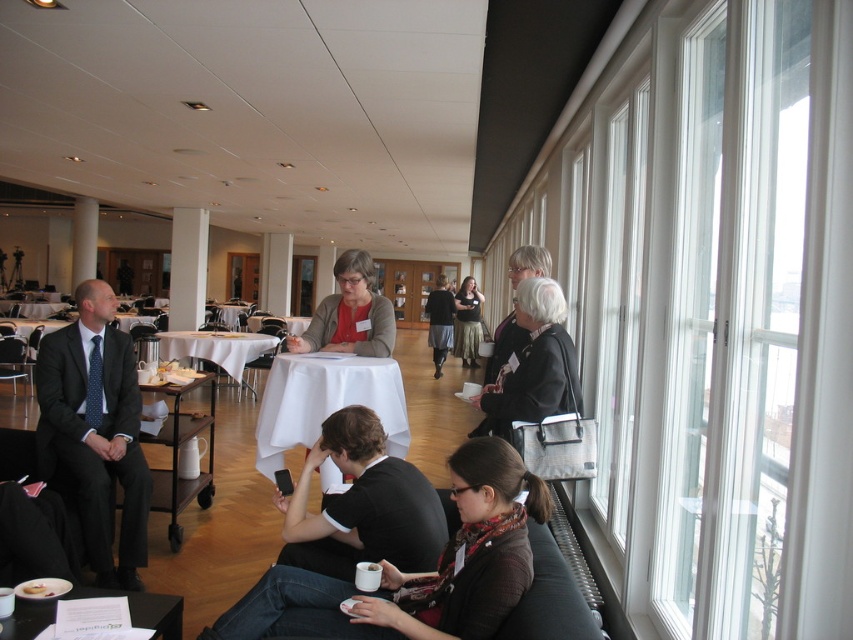
Does dark gray shirt at center have a greater width compared to matte black shirt at center?

Indeed, dark gray shirt at center has a greater width compared to matte black shirt at center.

Does dark gray shirt at center lie in front of matte black shirt at center?

Yes.

This screenshot has height=640, width=853. What do you see at coordinates (361, 504) in the screenshot? I see `dark gray shirt at center` at bounding box center [361, 504].

The height and width of the screenshot is (640, 853). I want to click on dark gray shirt at center, so click(x=361, y=504).

Does dark gray skirt at center have a greater height compared to matte brown cookie at lower left?

Indeed, dark gray skirt at center has a greater height compared to matte brown cookie at lower left.

Does dark gray skirt at center lie behind matte brown cookie at lower left?

Yes, it is behind matte brown cookie at lower left.

Is point (427, 298) closer to camera compared to point (28, 593)?

No, it is not.

Where is `dark gray skirt at center`? This screenshot has width=853, height=640. dark gray skirt at center is located at coordinates (440, 321).

Is matte gray sweater at center to the left of matte black shirt at center from the viewer's perspective?

Indeed, matte gray sweater at center is positioned on the left side of matte black shirt at center.

Can you confirm if matte gray sweater at center is positioned to the right of matte black shirt at center?

Incorrect, matte gray sweater at center is not on the right side of matte black shirt at center.

The height and width of the screenshot is (640, 853). Identify the location of matte gray sweater at center. (350, 314).

This screenshot has width=853, height=640. I want to click on matte gray sweater at center, so click(350, 314).